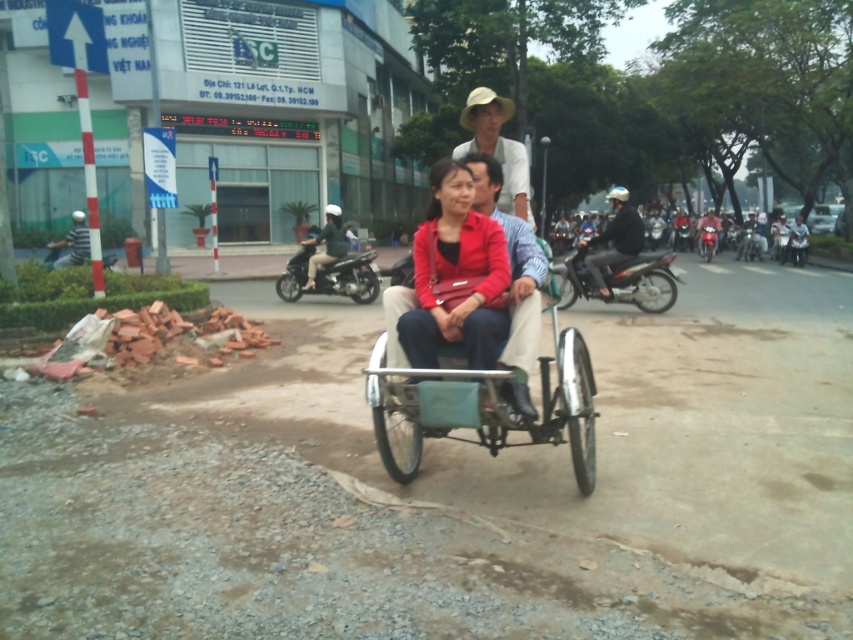
Question: Which is farther from the metallic silver rickshaw at center?

Choices:
 (A) metallic silver motorcycle at center
 (B) shiny silver motorcycle at center-right
 (C) metallic silver motorcycle at right

Answer: (A)

Question: Is matte blue shirt at center below shiny black motorcycle at center?

Choices:
 (A) yes
 (B) no

Answer: (A)

Question: From the image, what is the correct spatial relationship of shiny silver motorcycle at center-right in relation to natural straw hat at center?

Choices:
 (A) right
 (B) left

Answer: (A)

Question: Which point is farther from the camera taking this photo?

Choices:
 (A) (335, 257)
 (B) (740, 257)

Answer: (B)

Question: Does natural straw hat at center have a lesser width compared to metallic silver motorcycle at center?

Choices:
 (A) yes
 (B) no

Answer: (B)

Question: Which object appears farthest from the camera in this image?

Choices:
 (A) natural straw hat at center
 (B) dark blue helmet at right
 (C) metallic silver rickshaw at center
 (D) dark blue shirt at center

Answer: (D)